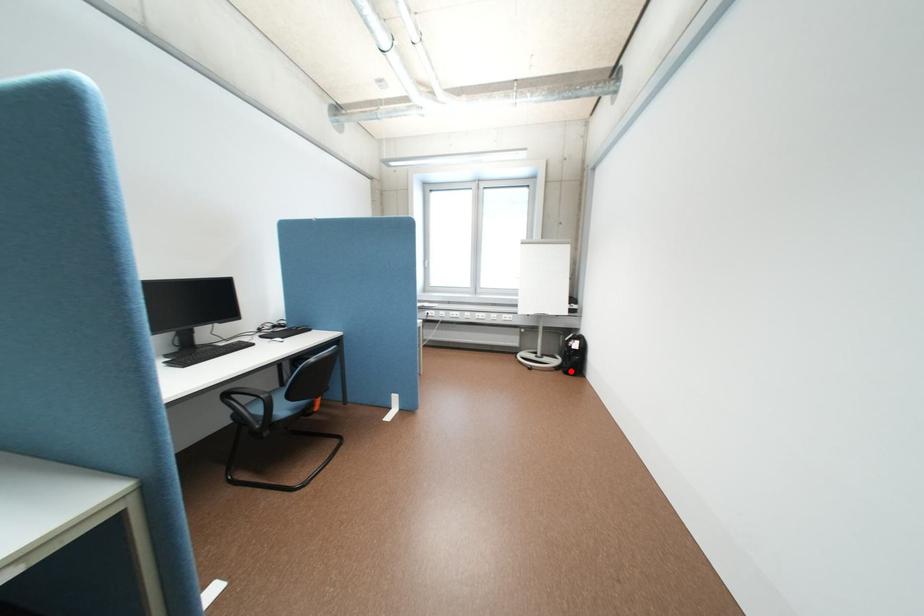
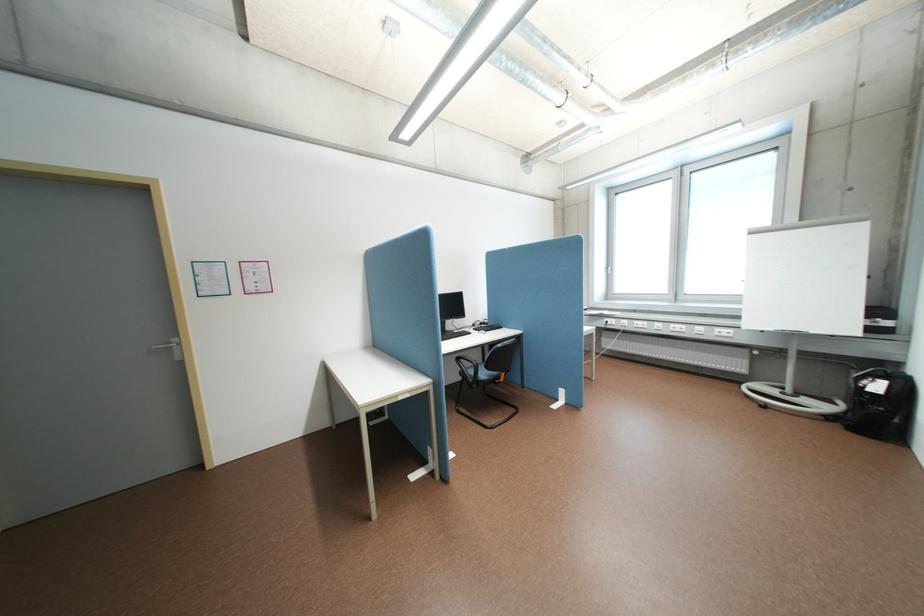
Where in the second image is the point corresponding to the highlighted location from the first image?

(848, 424)